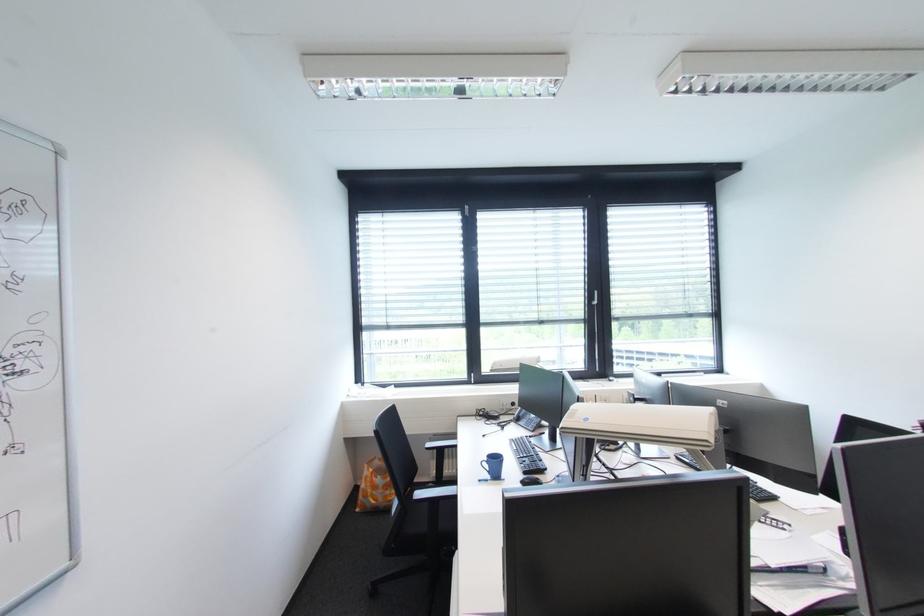
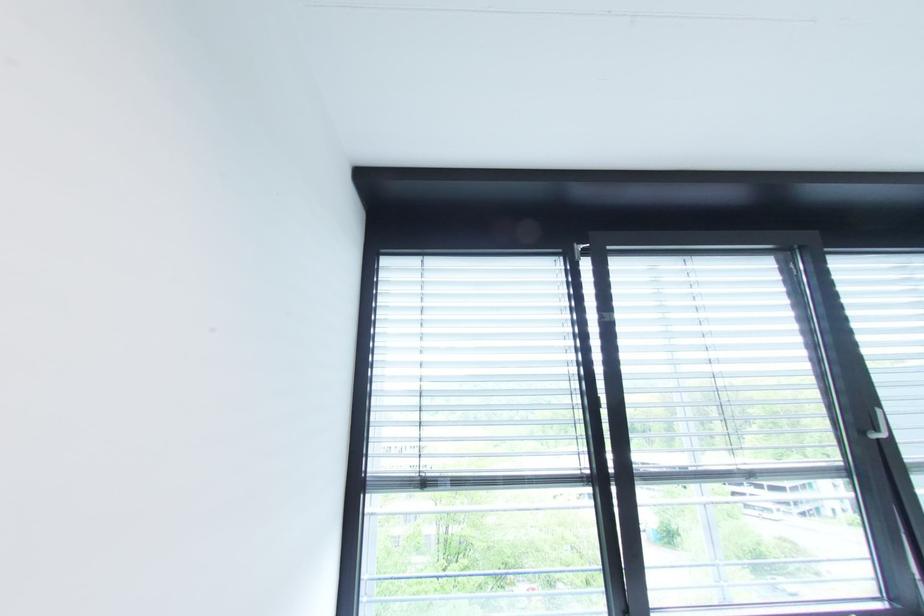
What movement of the cameraman would produce the second image?

The cameraman moved toward left, forward.